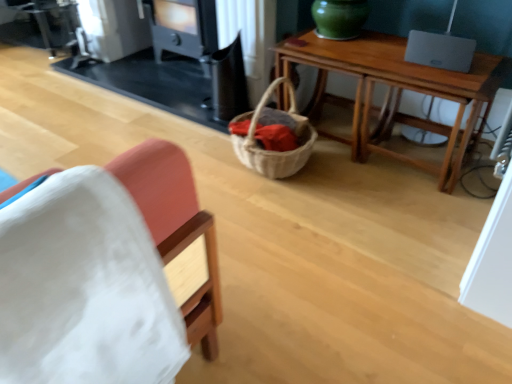
Question: From the image's perspective, is black matte stove at upper center located above or below black matte fireplace at upper center?

Choices:
 (A) below
 (B) above

Answer: (B)

Question: Considering the positions of point (153, 23) and point (96, 64), is point (153, 23) closer or farther from the camera than point (96, 64)?

Choices:
 (A) farther
 (B) closer

Answer: (B)

Question: Which of these objects is positioned closest to the black matte stove at upper center?

Choices:
 (A) wooden table at center
 (B) black matte fireplace at upper center
 (C) white fabric chair at left

Answer: (B)

Question: Considering the real-world distances, which object is farthest from the wooden table at center?

Choices:
 (A) black matte fireplace at upper center
 (B) black matte stove at upper center
 (C) white fabric chair at left

Answer: (C)